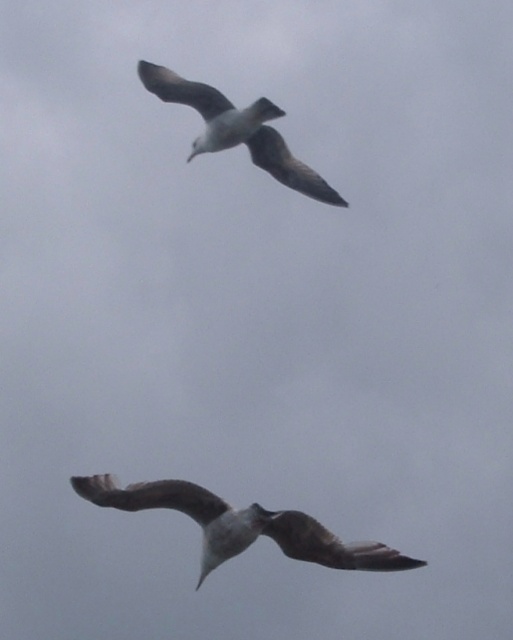
You are a birdwatcher trying to identify two birds in the sky. You see a brown feathered bird at center and a white feathered bird at upper center. Which bird has a greater wingspan?

The brown feathered bird at center has a greater wingspan than the white feathered bird at upper center because its width is larger.

You are a birdwatcher observing two points in the sky. You notice that one point is closer to you than the other. Which point, point (85, 481) or point (235, 141), is closer to you?

Point (85, 481) is in front of point (235, 141), so it is closer to you.

You are a birdwatcher trying to locate a specific bird in the image. You know that the bird you are looking for is located exactly at the point with coordinates 0.822 in the x direction and 0.474 in the y direction. Based on the scene description, can you identify which bird at the center is the one at point (243, 525)?

The brown feathered bird at center is located at point (243, 525).